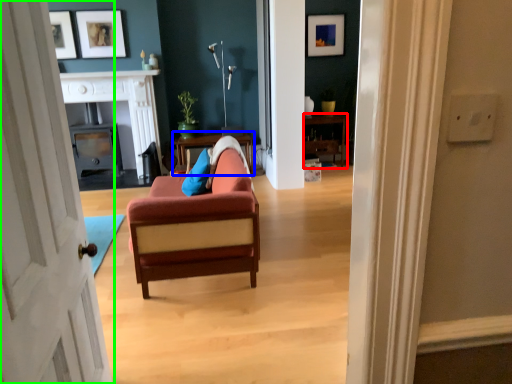
Question: Which is nearer to the dresser (highlighted by a red box)? table (highlighted by a blue box) or door (highlighted by a green box).

Choices:
 (A) table
 (B) door

Answer: (A)